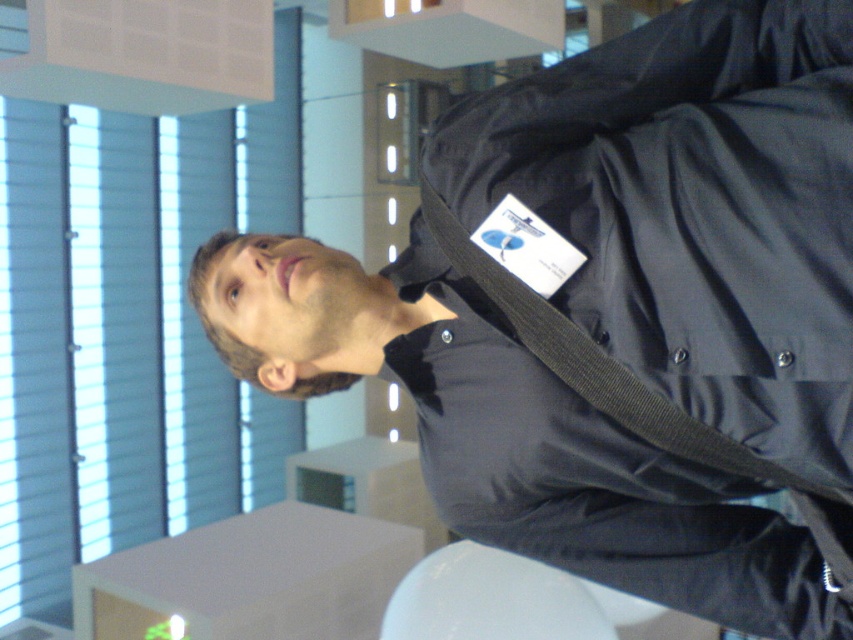
You are a photographer setting up a shot of the person in the scene. You notice the blue fabric blinds at left and the black fabric strap at upper right in the background. Which object should you adjust your camera angle to avoid overlapping with the person, based on their vertical positions?

The blue fabric blinds at left is located above the black fabric strap at upper right, so adjusting the camera angle downward would avoid overlapping with the blue fabric blinds at left, while tilting slightly upward might avoid the black fabric strap at upper right depending on their exact positions.

You are a photographer trying to capture a portrait of the person in the scene. You notice two points in the image labeled as point 1 and point 2. Point 1 is at coordinate (0, 285) and point 2 is at (788, 474). Which point is closer to you when focusing your camera lens?

Point 1 at coordinate (0, 285) is closer to you than point 2 at (788, 474) because it is further to the viewer in the image.

You are designing a layout for a poster and need to place two elements based on their sizes. The blue fabric blinds at left and black fabric strap at upper right are the elements to consider. Which element should you choose if you need a larger one for emphasis?

The blue fabric blinds at left should be chosen for emphasis since it has a larger size compared to the black fabric strap at upper right.